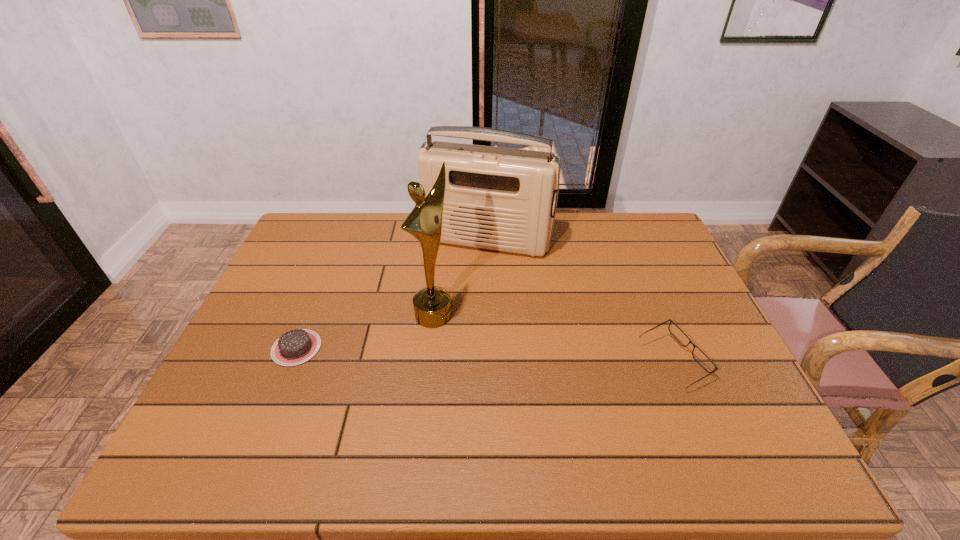
You are a GUI agent. You are given a task and a screenshot of the screen. Output one action in this format:
    pyautogui.click(x=<x>, y=<y>)
    Task: Click on the vacant space on the desktop that is between the leftmost object and the spectacles and is positioned on the front-facing side of the award
    This screenshot has height=540, width=960.
    Given the screenshot: What is the action you would take?
    (504, 355)

The image size is (960, 540). I want to click on free space on the desktop that is between the shortest object and the rightmost object and is positioned on the front-facing side of the radio receiver, so [448, 353].